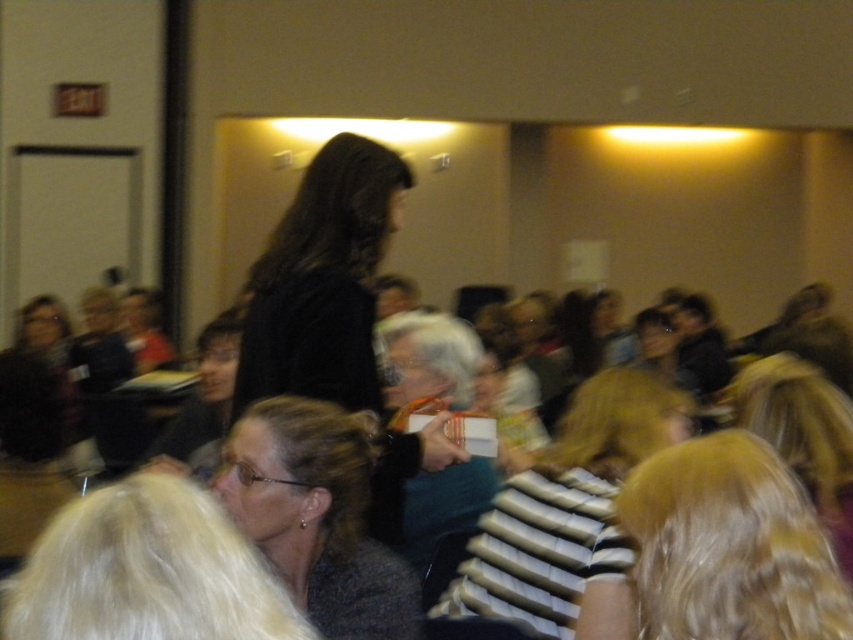
You are a person in the conference room holding a striped fabric bag at center and a dark gray textured sweater at center. You need to place both items on a table that is 20 inches away from you. Can you fit both items on the table without overlapping?

The striped fabric bag at center is 20.21 inches away from dark gray textured sweater at center, which is slightly more than the 20 inches distance to the table. Therefore, placing both items on the table without overlapping might not be possible since the required space between them exceeds the available distance.

You are a photographer in the conference room and need to adjust your camera focus. There are two points in the scene you must consider for focus adjustment. The first point is at coordinate point (606, 374), and the second is at coordinate point (247, 476). Which of these two points is closer to your camera lens?

Point (606, 374) is closer to the camera lens because it is further to the camera than point (247, 476).

You are an attendee in the conference room and you want to hand a document to the person sitting in front of you. There is a striped fabric bag at center and a dark gray textured sweater at center in your way. Which object is closer to you that you might need to move to pass the document?

The striped fabric bag at center is closer to the viewer than the dark gray textured sweater at center, so you would need to move the striped fabric bag at center first to pass the document.